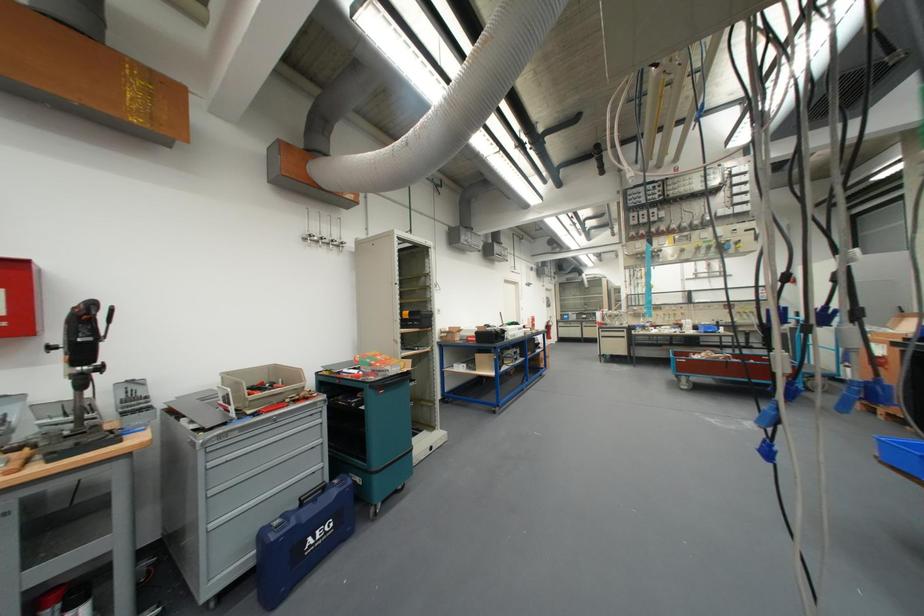
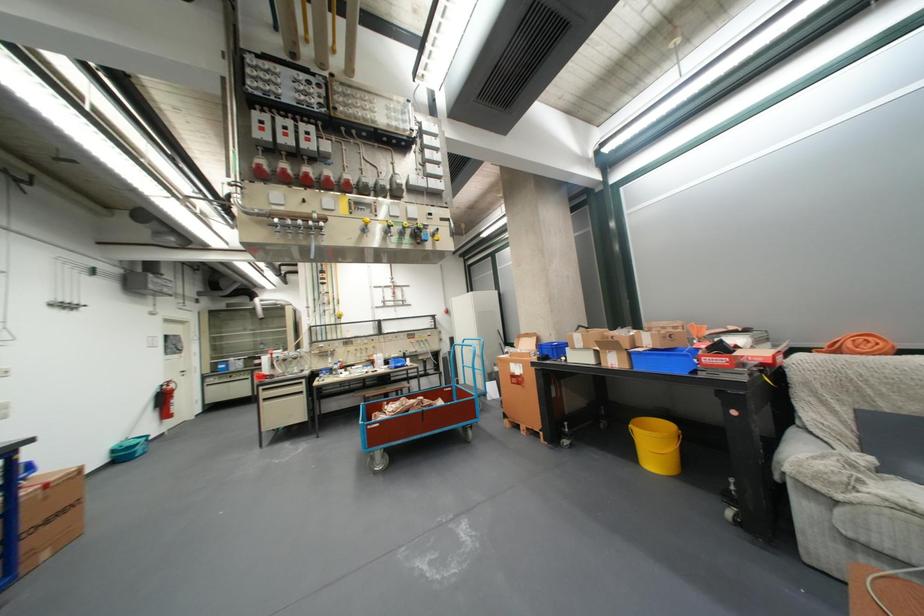
Locate, in the second image, the point that corresponds to (894,411) in the first image.

(535, 428)